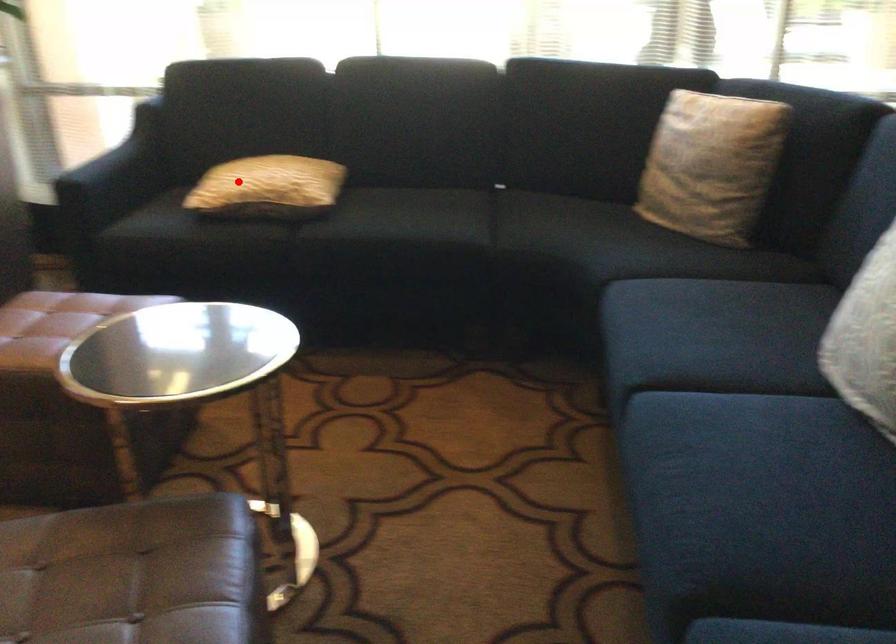
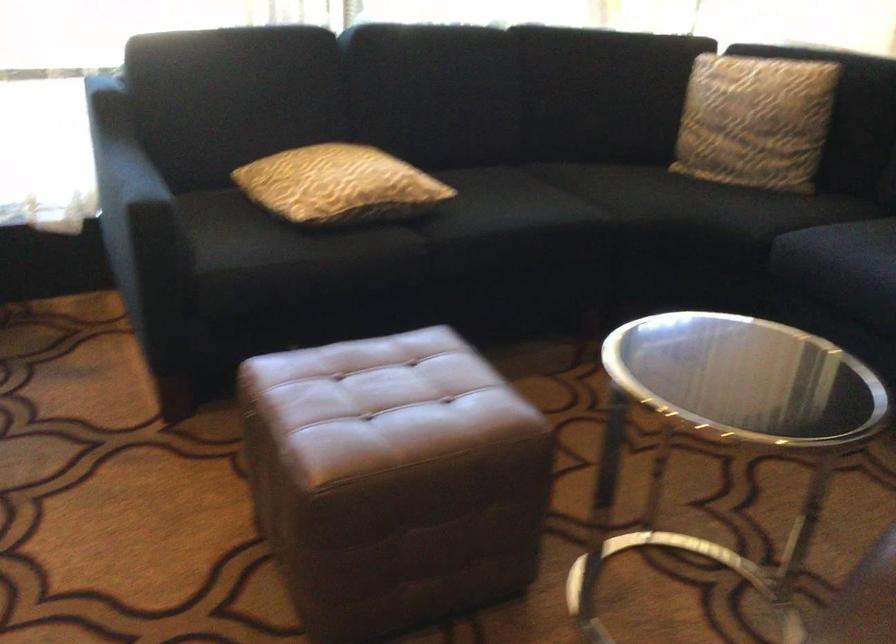
The point at the highlighted location is marked in the first image. Where is the corresponding point in the second image?

(339, 185)